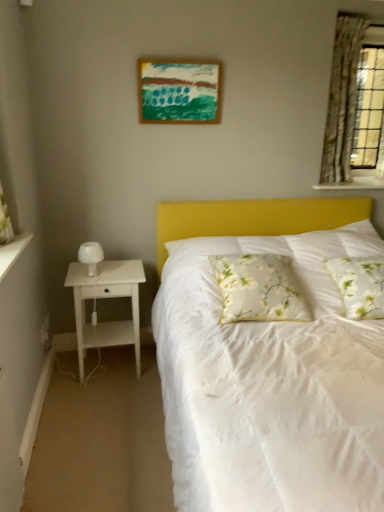
Locate an element on the screen. white floral fabric pillow at center, which is counted as the first pillow, starting from the right is located at coordinates (359, 285).

The height and width of the screenshot is (512, 384). Find the location of `white matte table lamp at left`. white matte table lamp at left is located at coordinates (91, 256).

Measure the distance between point [84,251] and camera.

A distance of 8.69 feet exists between point [84,251] and camera.

The height and width of the screenshot is (512, 384). What are the coordinates of `green floral fabric curtain at upper right` in the screenshot? It's located at (342, 98).

The image size is (384, 512). What do you see at coordinates (258, 288) in the screenshot?
I see `white floral pillow at center, marked as the second pillow in a right-to-left arrangement` at bounding box center [258, 288].

Locate an element on the screen. Image resolution: width=384 pixels, height=512 pixels. white floral pillow at center, marked as the second pillow in a right-to-left arrangement is located at coordinates (258, 288).

Locate an element on the screen. white floral fabric pillow at center, which is counted as the first pillow, starting from the right is located at coordinates (359, 285).

Considering the positions of point (242, 269) and point (212, 106), is point (242, 269) closer or farther from the camera than point (212, 106)?

Point (242, 269) is positioned closer to the camera compared to point (212, 106).

Is white floral pillow at center, marked as the second pillow in a right-to-left arrangement, not close to acrylic painting at upper center?

white floral pillow at center, marked as the second pillow in a right-to-left arrangement, is far away from acrylic painting at upper center.

From a real-world perspective, who is located lower, white floral pillow at center, which is the 1th pillow from left to right, or acrylic painting at upper center?

white floral pillow at center, which is the 1th pillow from left to right, is physically lower.

Who is bigger, white floral pillow at center, marked as the second pillow in a right-to-left arrangement, or acrylic painting at upper center?

white floral pillow at center, marked as the second pillow in a right-to-left arrangement, is bigger.

Is white wood nightstand at left not inside white matte table lamp at left?

white wood nightstand at left is positioned outside white matte table lamp at left.

Is white wood nightstand at left wider or thinner than white matte table lamp at left?

Clearly, white wood nightstand at left has more width compared to white matte table lamp at left.

From the picture: From the image's perspective, which one is positioned lower, white wood nightstand at left or white matte table lamp at left?

white wood nightstand at left is shown below in the image.

Considering the relative positions of white wood nightstand at left and white matte table lamp at left in the image provided, is white wood nightstand at left to the left or to the right of white matte table lamp at left?

white wood nightstand at left is to the right of white matte table lamp at left.

Which object is positioned more to the left, acrylic painting at upper center or white wood nightstand at left?

white wood nightstand at left.

Considering the relative positions of acrylic painting at upper center and white wood nightstand at left in the image provided, is acrylic painting at upper center in front of white wood nightstand at left?

No.

Is point (175, 79) closer to camera compared to point (137, 343)?

Yes, it is.

From the image's perspective, is acrylic painting at upper center located beneath white wood nightstand at left?

Incorrect, from the image's perspective, acrylic painting at upper center is higher than white wood nightstand at left.

From the image's perspective, which pillow is the 2nd one below the white textured shelf at upper right? Please provide its 2D coordinates.

[(258, 288)]

In the scene shown: Does white textured shelf at upper right touch white floral pillow at center, marked as the second pillow in a right-to-left arrangement?

No, white textured shelf at upper right is not with white floral pillow at center, marked as the second pillow in a right-to-left arrangement.

From a real-world perspective, who is located higher, white textured shelf at upper right or white floral pillow at center, marked as the second pillow in a right-to-left arrangement?

white textured shelf at upper right, from a real-world perspective.

Is white textured shelf at upper right positioned in front of white floral pillow at center, marked as the second pillow in a right-to-left arrangement?

No, the depth of white textured shelf at upper right is greater than that of white floral pillow at center, marked as the second pillow in a right-to-left arrangement.

Looking at this image, can you tell me how much white wood nightstand at left and green floral fabric curtain at upper right differ in facing direction?

The facing directions of white wood nightstand at left and green floral fabric curtain at upper right are 0.546 degrees apart.

In the scene shown: Is white wood nightstand at left not near green floral fabric curtain at upper right?

Indeed, white wood nightstand at left is not near green floral fabric curtain at upper right.

Consider the image. From the image's perspective, who appears lower, white wood nightstand at left or green floral fabric curtain at upper right?

white wood nightstand at left.

Is point (96, 345) positioned before point (360, 48)?

Yes, point (96, 345) is in front of point (360, 48).

Considering the points (356, 59) and (104, 264), which point is behind, point (356, 59) or point (104, 264)?

The point (356, 59) is farther from the camera.

Which object is thinner, green floral fabric curtain at upper right or white wood nightstand at left?

green floral fabric curtain at upper right is thinner.

Is green floral fabric curtain at upper right positioned behind white wood nightstand at left?

Yes, the depth of green floral fabric curtain at upper right is greater than that of white wood nightstand at left.

Does green floral fabric curtain at upper right have a larger size compared to white wood nightstand at left?

No.

Consider the image. From a real-world perspective, who is located lower, green floral fabric curtain at upper right or acrylic painting at upper center?

green floral fabric curtain at upper right.

Consider the image. How much distance is there between green floral fabric curtain at upper right and acrylic painting at upper center?

The distance of green floral fabric curtain at upper right from acrylic painting at upper center is 3.33 feet.

In the scene shown: Between green floral fabric curtain at upper right and acrylic painting at upper center, which one has less height?

acrylic painting at upper center.

Locate an element on the screen. Image resolution: width=384 pixels, height=512 pixels. the 2nd pillow below the acrylic painting at upper center (from the image's perspective) is located at coordinates (258, 288).

Where is `table lamp that is on the left side of white wood nightstand at left`? This screenshot has width=384, height=512. table lamp that is on the left side of white wood nightstand at left is located at coordinates (91, 256).

Looking at the image, which one is located further to white matte table lamp at left, white textured shelf at upper right or white wood nightstand at left?

The object further to white matte table lamp at left is white textured shelf at upper right.

From the image, which object appears to be nearer to white wood nightstand at left, white textured shelf at upper right or green floral fabric curtain at upper right?

white textured shelf at upper right.

From the picture: Based on their spatial positions, is white wood nightstand at left or white textured shelf at upper right further from white floral fabric pillow at center, which is counted as the first pillow, starting from the right?

white wood nightstand at left lies further to white floral fabric pillow at center, which is counted as the first pillow, starting from the right, than the other object.

Which object lies further to the anchor point white matte table lamp at left, white floral pillow at center, marked as the second pillow in a right-to-left arrangement, or acrylic painting at upper center?

Among the two, acrylic painting at upper center is located further to white matte table lamp at left.

Looking at the image, which one is located closer to white textured shelf at upper right, green floral fabric curtain at upper right or white wood nightstand at left?

The object closer to white textured shelf at upper right is green floral fabric curtain at upper right.

Considering their positions, is white floral pillow at center, which is the 1th pillow from left to right, positioned further to white textured shelf at upper right than white wood nightstand at left?

Among the two, white wood nightstand at left is located further to white textured shelf at upper right.

Estimate the real-world distances between objects in this image. Which object is further from white floral fabric pillow at center, the 2th pillow when ordered from left to right, white textured shelf at upper right or white floral pillow at center, marked as the second pillow in a right-to-left arrangement?

white textured shelf at upper right is positioned further to the anchor white floral fabric pillow at center, the 2th pillow when ordered from left to right.

From the image, which object appears to be nearer to white floral fabric pillow at center, the 2th pillow when ordered from left to right, green floral fabric curtain at upper right or white textured shelf at upper right?

white textured shelf at upper right is closer to white floral fabric pillow at center, the 2th pillow when ordered from left to right.

Identify the location of table lamp between acrylic painting at upper center and white wood nightstand at left in the vertical direction. This screenshot has width=384, height=512. (91, 256).

Where is `picture frame that lies between green floral fabric curtain at upper right and white wood nightstand at left from top to bottom`? Image resolution: width=384 pixels, height=512 pixels. picture frame that lies between green floral fabric curtain at upper right and white wood nightstand at left from top to bottom is located at coordinates (179, 91).

Find the location of a particular element. This screenshot has height=512, width=384. window sill between green floral fabric curtain at upper right and white floral fabric pillow at center, which is counted as the first pillow, starting from the right, from top to bottom is located at coordinates (355, 183).

This screenshot has height=512, width=384. Identify the location of pillow between white matte table lamp at left and white floral fabric pillow at center, the 2th pillow when ordered from left to right, in the horizontal direction. (258, 288).